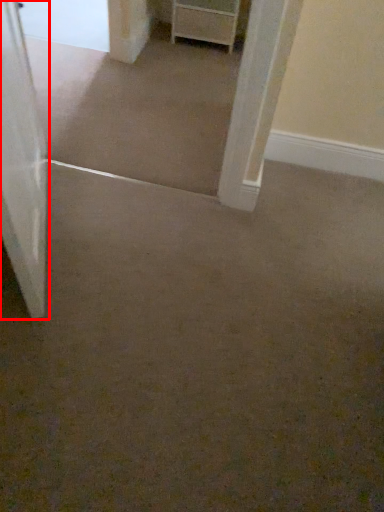
Question: In this image, where is door (annotated by the red box) located relative to chest of drawers?

Choices:
 (A) left
 (B) right

Answer: (A)